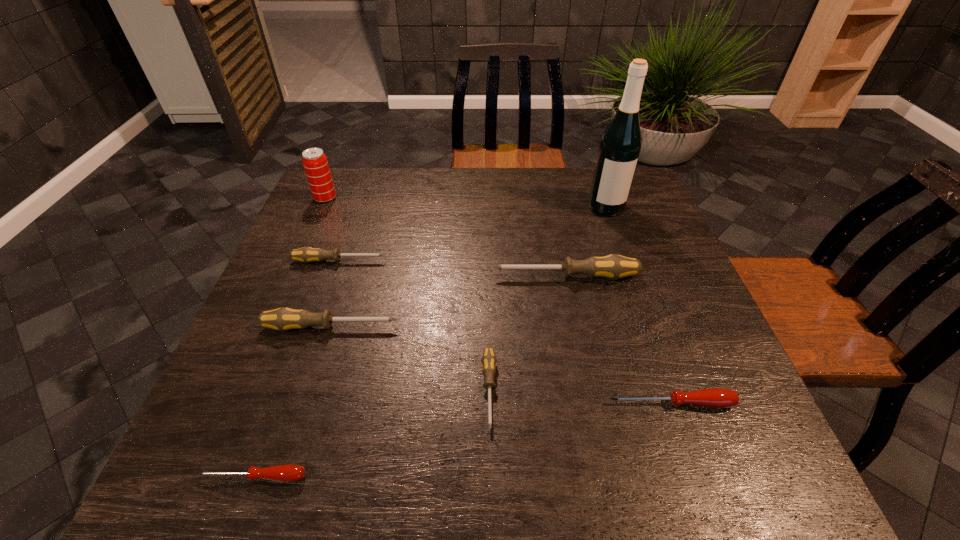
The width and height of the screenshot is (960, 540). What are the coordinates of `wine bottle` in the screenshot? It's located at (620, 146).

You are a GUI agent. You are given a task and a screenshot of the screen. Output one action in this format:
    pyautogui.click(x=<x>, y=<y>)
    Task: Click on the dark wine bottle
    The width and height of the screenshot is (960, 540).
    Given the screenshot: What is the action you would take?
    pyautogui.click(x=620, y=146)

Where is `soda can`? Image resolution: width=960 pixels, height=540 pixels. soda can is located at coordinates (315, 163).

The image size is (960, 540). I want to click on the fifth nearest screwdriver, so click(613, 266).

Locate an element on the screen. The image size is (960, 540). the tallest screwdriver is located at coordinates (613, 266).

The image size is (960, 540). I want to click on the fourth tallest object, so click(x=283, y=319).

Image resolution: width=960 pixels, height=540 pixels. Find the location of `the second biggest gray screwdriver`. the second biggest gray screwdriver is located at coordinates (283, 319).

Image resolution: width=960 pixels, height=540 pixels. Identify the location of the farthest screwdriver. (306, 254).

Locate an element on the screen. The image size is (960, 540). the farthest gray screwdriver is located at coordinates (306, 254).

You are a GUI agent. You are given a task and a screenshot of the screen. Output one action in this format:
    pyautogui.click(x=<x>, y=<y>)
    Task: Click on the bigger red screwdriver
    The height and width of the screenshot is (540, 960).
    Given the screenshot: What is the action you would take?
    pyautogui.click(x=714, y=397)